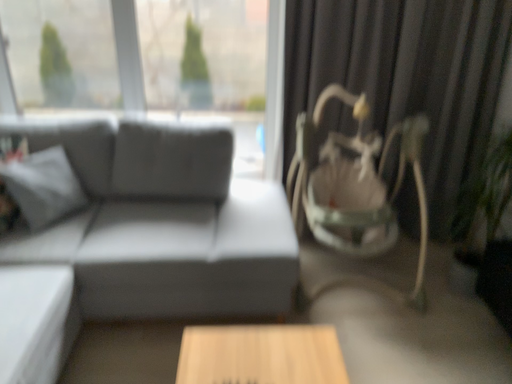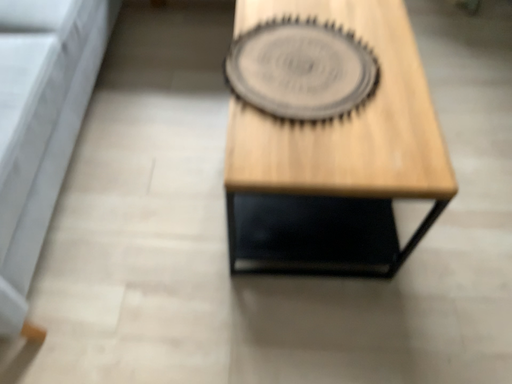
Question: How did the camera likely rotate when shooting the video?

Choices:
 (A) rotated downward
 (B) rotated upward

Answer: (A)